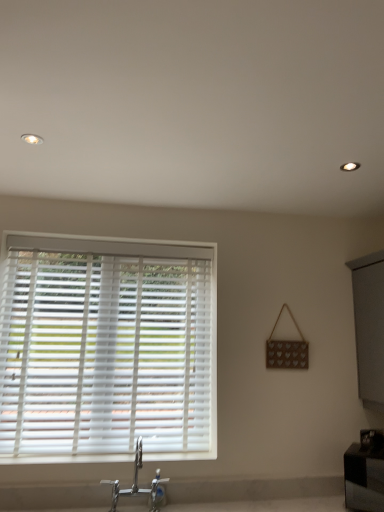
Locate an element on the screen. This screenshot has height=512, width=384. chrome metallic faucet at lower center is located at coordinates (137, 484).

Describe the element at coordinates (364, 478) in the screenshot. I see `black glossy vanity at lower right` at that location.

Locate an element on the screen. The image size is (384, 512). chrome metallic faucet at lower center is located at coordinates pyautogui.click(x=137, y=484).

Considering the sizes of objects chrome metallic faucet at lower center and white plastic blinds at left in the image provided, who is smaller, chrome metallic faucet at lower center or white plastic blinds at left?

chrome metallic faucet at lower center is smaller.

From the image's perspective, is chrome metallic faucet at lower center below white plastic blinds at left?

Yes.

Based on the photo, considering the sizes of chrome metallic faucet at lower center and white plastic blinds at left in the image, is chrome metallic faucet at lower center taller or shorter than white plastic blinds at left?

In the image, chrome metallic faucet at lower center appears to be shorter than white plastic blinds at left.

Considering the relative positions of chrome metallic faucet at lower center and white plastic blinds at left in the image provided, is chrome metallic faucet at lower center to the left of white plastic blinds at left from the viewer's perspective?

Incorrect, chrome metallic faucet at lower center is not on the left side of white plastic blinds at left.

From a real-world perspective, between black glossy vanity at lower right and white plastic blinds at left, who is vertically lower?

black glossy vanity at lower right, from a real-world perspective.

Is black glossy vanity at lower right shorter than white plastic blinds at left?

Correct, black glossy vanity at lower right is not as tall as white plastic blinds at left.

Considering the sizes of objects black glossy vanity at lower right and white plastic blinds at left in the image provided, who is wider, black glossy vanity at lower right or white plastic blinds at left?

With larger width is black glossy vanity at lower right.

Which is correct: white plastic blinds at left is inside black glossy vanity at lower right, or outside of it?

white plastic blinds at left cannot be found inside black glossy vanity at lower right.

Is white plastic blinds at left bigger or smaller than black glossy vanity at lower right?

Clearly, white plastic blinds at left is larger in size than black glossy vanity at lower right.

From a real-world perspective, does white plastic blinds at left stand above black glossy vanity at lower right?

Yes.

Between point (26, 311) and point (376, 457), which one is positioned behind?

Point (26, 311)

How far apart are black glossy vanity at lower right and chrome metallic faucet at lower center?

black glossy vanity at lower right and chrome metallic faucet at lower center are 1.01 meters apart from each other.

Can you confirm if black glossy vanity at lower right is taller than chrome metallic faucet at lower center?

No, black glossy vanity at lower right is not taller than chrome metallic faucet at lower center.

Which object is further away from the camera taking this photo, black glossy vanity at lower right or chrome metallic faucet at lower center?

black glossy vanity at lower right is further from the camera.

In the scene shown: Is black glossy vanity at lower right wider than chrome metallic faucet at lower center?

Indeed, black glossy vanity at lower right has a greater width compared to chrome metallic faucet at lower center.

From the picture: Who is shorter, white plastic blinds at left or chrome metallic faucet at lower center?

With less height is chrome metallic faucet at lower center.

Can you confirm if white plastic blinds at left is positioned to the left of chrome metallic faucet at lower center?

Yes.

How different are the orientations of white plastic blinds at left and chrome metallic faucet at lower center in degrees?

The angle between the facing direction of white plastic blinds at left and the facing direction of chrome metallic faucet at lower center is 0.395 degrees.

From a real-world perspective, is white plastic blinds at left beneath chrome metallic faucet at lower center?

Actually, white plastic blinds at left is physically above chrome metallic faucet at lower center in the real world.

Considering the sizes of objects chrome metallic faucet at lower center and black glossy vanity at lower right in the image provided, who is shorter, chrome metallic faucet at lower center or black glossy vanity at lower right?

black glossy vanity at lower right.

From the image's perspective, is chrome metallic faucet at lower center positioned above or below black glossy vanity at lower right?

Based on their image positions, chrome metallic faucet at lower center is located above black glossy vanity at lower right.

Identify the location of vanity below the chrome metallic faucet at lower center (from the image's perspective). Image resolution: width=384 pixels, height=512 pixels. (364, 478).

Considering the points (140, 456) and (368, 462), which point is in front, point (140, 456) or point (368, 462)?

The point (140, 456) is in front.

The width and height of the screenshot is (384, 512). I want to click on window blind that appears behind the chrome metallic faucet at lower center, so click(x=107, y=348).

Where is `window blind located above the black glossy vanity at lower right (from the image's perspective)`? Image resolution: width=384 pixels, height=512 pixels. window blind located above the black glossy vanity at lower right (from the image's perspective) is located at coordinates (107, 348).

Looking at the image, which one is located further to black glossy vanity at lower right, chrome metallic faucet at lower center or white plastic blinds at left?

white plastic blinds at left.

Which object lies nearer to the anchor point black glossy vanity at lower right, white plastic blinds at left or chrome metallic faucet at lower center?

The object closer to black glossy vanity at lower right is chrome metallic faucet at lower center.

Which object lies further to the anchor point chrome metallic faucet at lower center, white plastic blinds at left or black glossy vanity at lower right?

The object further to chrome metallic faucet at lower center is black glossy vanity at lower right.

From the image, which object appears to be nearer to chrome metallic faucet at lower center, black glossy vanity at lower right or white plastic blinds at left?

white plastic blinds at left is closer to chrome metallic faucet at lower center.

Considering their positions, is black glossy vanity at lower right positioned closer to white plastic blinds at left than chrome metallic faucet at lower center?

chrome metallic faucet at lower center is closer to white plastic blinds at left.

Looking at the image, which one is located closer to white plastic blinds at left, chrome metallic faucet at lower center or black glossy vanity at lower right?

Based on the image, chrome metallic faucet at lower center appears to be nearer to white plastic blinds at left.

At what (x,y) coordinates should I click in order to perform the action: click on tap between white plastic blinds at left and black glossy vanity at lower right. Please return your answer as a coordinate pair (x, y). Looking at the image, I should click on 137,484.